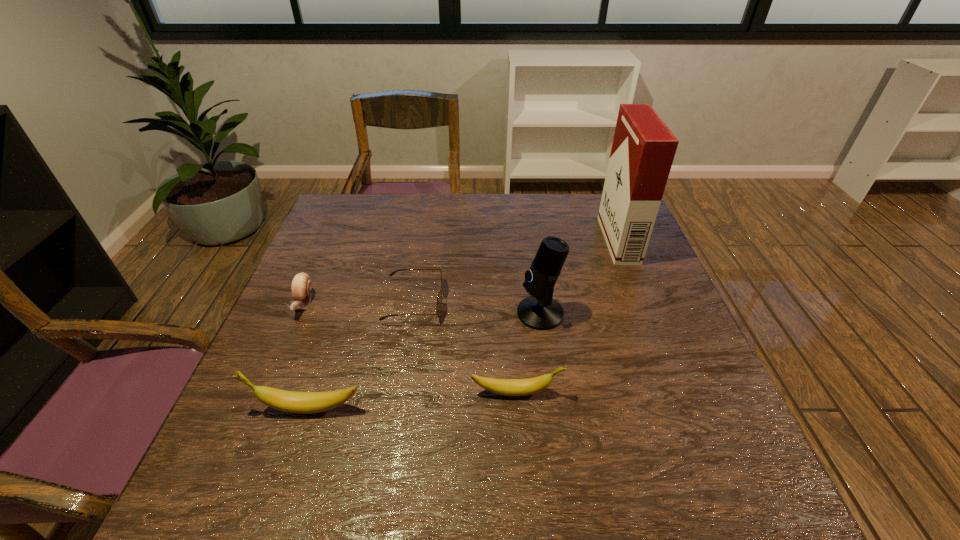
At what (x,y) coordinates should I click in order to perform the action: click on vacant area at the far right corner. Please return your answer as a coordinate pair (x, y). Looking at the image, I should click on (587, 209).

You are a GUI agent. You are given a task and a screenshot of the screen. Output one action in this format:
    pyautogui.click(x=<x>, y=<y>)
    Task: Click on the free space at the near right corner of the desktop
    This screenshot has width=960, height=540.
    Given the screenshot: What is the action you would take?
    pyautogui.click(x=675, y=428)

Find the location of a particular element. The height and width of the screenshot is (540, 960). vacant region between the escargot and the sunglasses is located at coordinates (359, 302).

The width and height of the screenshot is (960, 540). Identify the location of free space that is in between the sunglasses and the taller banana. point(360,355).

Where is `free space between the microphone and the third shortest object`? This screenshot has height=540, width=960. free space between the microphone and the third shortest object is located at coordinates (528, 353).

Locate an element on the screen. The height and width of the screenshot is (540, 960). empty space that is in between the tallest object and the escargot is located at coordinates tap(461, 272).

The height and width of the screenshot is (540, 960). Identify the location of empty space between the second tallest object and the escargot. 421,308.

Where is `free spot between the shorter banana and the rightmost object`? This screenshot has height=540, width=960. free spot between the shorter banana and the rightmost object is located at coordinates (567, 316).

Where is `blank region between the sunglasses and the tallest object`? The width and height of the screenshot is (960, 540). blank region between the sunglasses and the tallest object is located at coordinates (516, 271).

You are a GUI agent. You are given a task and a screenshot of the screen. Output one action in this format:
    pyautogui.click(x=<x>, y=<y>)
    Task: Click on the vacant space in between the farthest object and the left banana
    This screenshot has height=540, width=960.
    Given the screenshot: What is the action you would take?
    pyautogui.click(x=463, y=324)